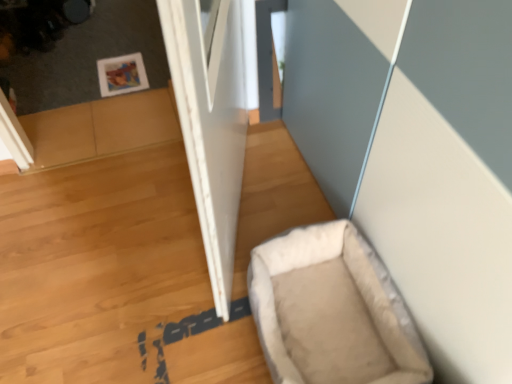
The height and width of the screenshot is (384, 512). Identify the location of blank area to the left of beige fabric dog bed at lower right. (178, 312).